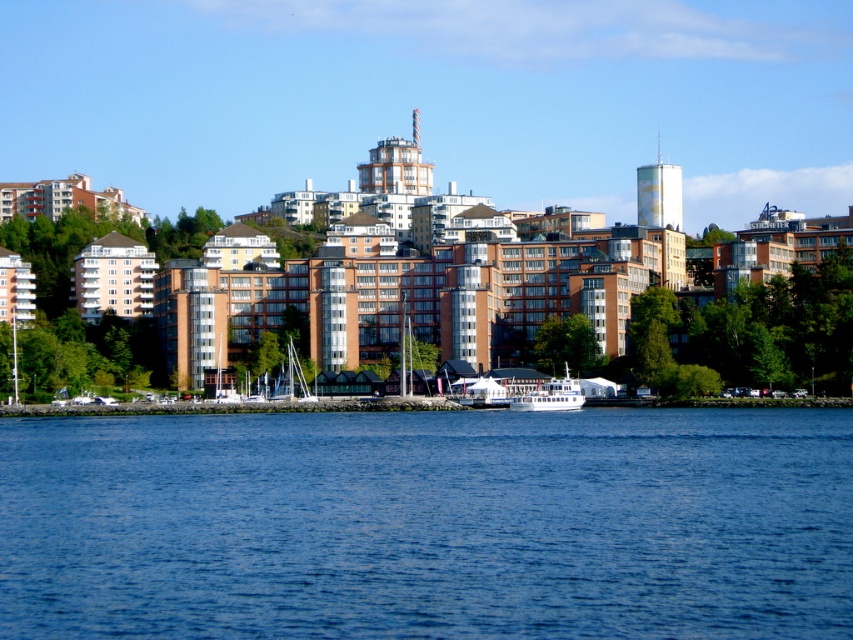
Question: Is blue liquid water at center smaller than white glossy ferry at center?

Choices:
 (A) yes
 (B) no

Answer: (B)

Question: Which object is farther from the camera taking this photo?

Choices:
 (A) white matte sailboat at center
 (B) blue liquid water at center
 (C) white glossy ferry at center

Answer: (A)

Question: Can you confirm if blue liquid water at center is thinner than white glossy ferry at center?

Choices:
 (A) no
 (B) yes

Answer: (A)

Question: Which point is farther to the camera?

Choices:
 (A) (483, 401)
 (B) (531, 465)
 (C) (535, 404)

Answer: (A)

Question: Which of the following is the closest to the observer?

Choices:
 (A) (560, 401)
 (B) (265, 532)
 (C) (486, 392)

Answer: (B)

Question: Can you confirm if white glossy ferry at center is smaller than white matte sailboat at center?

Choices:
 (A) no
 (B) yes

Answer: (A)